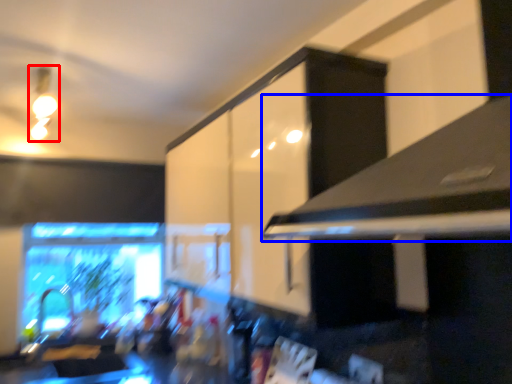
Question: Which object is further to the camera taking this photo, light fixture (highlighted by a red box) or exhaust hood (highlighted by a blue box)?

Choices:
 (A) light fixture
 (B) exhaust hood

Answer: (A)